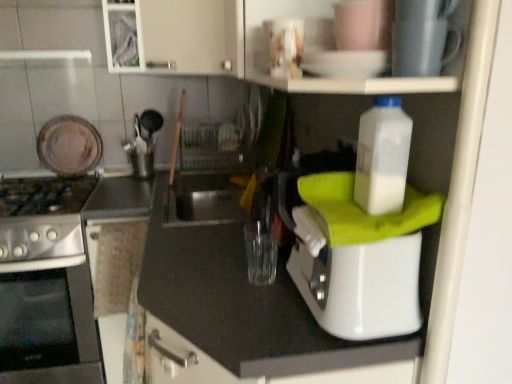
What do you see at coordinates (382, 157) in the screenshot?
I see `white plastic bottle at upper right` at bounding box center [382, 157].

The image size is (512, 384). In order to click on white plastic bottle at upper right in this screenshot , I will do `click(382, 157)`.

Image resolution: width=512 pixels, height=384 pixels. I want to click on matte brown plate at upper left, the second appliance when ordered from right to left, so coord(69,146).

What do you see at coordinates (42, 218) in the screenshot? The width and height of the screenshot is (512, 384). I see `satin silver gas stove at left` at bounding box center [42, 218].

You are a GUI agent. You are given a task and a screenshot of the screen. Output one action in this format:
    pyautogui.click(x=<x>, y=<y>)
    Task: Click on the white matte cabinet at upper center
    
    Given the screenshot: What is the action you would take?
    pyautogui.click(x=175, y=36)

Is metallic silver cup at upper center, positioned as the second appliance in back-to-front order, bigger than matte brown plate at upper left, the second appliance when ordered from right to left?

No, metallic silver cup at upper center, positioned as the second appliance in back-to-front order, is not bigger than matte brown plate at upper left, the second appliance when ordered from right to left.

Does metallic silver cup at upper center, the 1th appliance from the front, turn towards matte brown plate at upper left, positioned as the first appliance in left-to-right order?

No, metallic silver cup at upper center, the 1th appliance from the front, is not aimed at matte brown plate at upper left, positioned as the first appliance in left-to-right order.

Considering the sizes of objects metallic silver cup at upper center, which appears as the 1th appliance when viewed from the right, and matte brown plate at upper left, which is the 1th appliance from back to front, in the image provided, who is shorter, metallic silver cup at upper center, which appears as the 1th appliance when viewed from the right, or matte brown plate at upper left, which is the 1th appliance from back to front,?

With less height is metallic silver cup at upper center, which appears as the 1th appliance when viewed from the right.

Is metallic silver cup at upper center, positioned as the second appliance in back-to-front order, oriented towards white matte cabinet at upper center?

No.

Considering the positions of objects metallic silver cup at upper center, the 1th appliance from the front, and white matte cabinet at upper center in the image provided, who is more to the right, metallic silver cup at upper center, the 1th appliance from the front, or white matte cabinet at upper center?

metallic silver cup at upper center, the 1th appliance from the front.

Considering their positions, is metallic silver cup at upper center, positioned as the second appliance in back-to-front order, located in front of or behind white matte cabinet at upper center?

metallic silver cup at upper center, positioned as the second appliance in back-to-front order, is positioned closer to the viewer than white matte cabinet at upper center.

This screenshot has height=384, width=512. Identify the location of home appliance below the white plastic bottle at upper right (from the image's perspective). (46, 284).

Can you confirm if stainless steel oven at left is bigger than white plastic bottle at upper right?

Correct, stainless steel oven at left is larger in size than white plastic bottle at upper right.

Are stainless steel oven at left and white plastic bottle at upper right located far from each other?

Yes.

How many degrees apart are the facing directions of matte brown plate at upper left, the second appliance when ordered from right to left, and white matte cabinet at upper center?

There is a 47.6-degree angle between the facing directions of matte brown plate at upper left, the second appliance when ordered from right to left, and white matte cabinet at upper center.

Considering the positions of point (91, 151) and point (231, 43), is point (91, 151) closer or farther from the camera than point (231, 43)?

Point (91, 151) is positioned farther from the camera compared to point (231, 43).

Relative to white matte cabinet at upper center, is matte brown plate at upper left, which is the 1th appliance from back to front, in front or behind?

In the image, matte brown plate at upper left, which is the 1th appliance from back to front, appears behind white matte cabinet at upper center.

Does matte brown plate at upper left, the second appliance when ordered from right to left, have a smaller size compared to white matte cabinet at upper center?

Correct, matte brown plate at upper left, the second appliance when ordered from right to left, occupies less space than white matte cabinet at upper center.

Where is `bottle that appears in front of the white matte cabinet at upper center`? Image resolution: width=512 pixels, height=384 pixels. bottle that appears in front of the white matte cabinet at upper center is located at coordinates click(x=382, y=157).

Is white matte cabinet at upper center in contact with white plastic bottle at upper right?

There is a gap between white matte cabinet at upper center and white plastic bottle at upper right.

Which is nearer, (x=238, y=22) or (x=362, y=166)?

Point (x=238, y=22) appears to be farther away from the viewer than point (x=362, y=166).

Considering the positions of objects matte brown plate at upper left, acting as the second appliance starting from the front, and stainless steel oven at left in the image provided, who is more to the right, matte brown plate at upper left, acting as the second appliance starting from the front, or stainless steel oven at left?

matte brown plate at upper left, acting as the second appliance starting from the front.

Is matte brown plate at upper left, which is the 1th appliance from back to front, not inside stainless steel oven at left?

Yes, matte brown plate at upper left, which is the 1th appliance from back to front, is outside of stainless steel oven at left.

What's the angular difference between matte brown plate at upper left, the second appliance when ordered from right to left, and stainless steel oven at left's facing directions?

1.98 degrees.

Would you consider matte brown plate at upper left, which is the 1th appliance from back to front, to be distant from stainless steel oven at left?

No.

Can you confirm if white matte cabinet at upper center is positioned to the right of matte brown plate at upper left, positioned as the first appliance in left-to-right order?

Yes.

From the image's perspective, which is above, white matte cabinet at upper center or matte brown plate at upper left, positioned as the first appliance in left-to-right order?

white matte cabinet at upper center appears higher in the image.

Does white matte cabinet at upper center have a larger size compared to matte brown plate at upper left, which is the 1th appliance from back to front?

Correct, white matte cabinet at upper center is larger in size than matte brown plate at upper left, which is the 1th appliance from back to front.

Find the location of a particular element. This screenshot has width=512, height=384. appliance directly beneath the metallic silver cup at upper center, positioned as the second appliance in back-to-front order (from a real-world perspective) is located at coordinates (69, 146).

This screenshot has width=512, height=384. I want to click on cabinetry above the metallic silver cup at upper center, which appears as the 1th appliance when viewed from the right (from the image's perspective), so click(x=175, y=36).

Looking at the image, which one is located closer to stainless steel oven at left, matte brown plate at upper left, which is the 1th appliance from back to front, or white plastic bottle at upper right?

matte brown plate at upper left, which is the 1th appliance from back to front, lies closer to stainless steel oven at left than the other object.

Estimate the real-world distances between objects in this image. Which object is closer to satin silver gas stove at left, stainless steel oven at left or matte brown plate at upper left, the second appliance when ordered from right to left?

stainless steel oven at left is closer to satin silver gas stove at left.

Considering their positions, is white matte cabinet at upper center positioned further to metallic silver cup at upper center, the 2th appliance from the left, than stainless steel oven at left?

The object further to metallic silver cup at upper center, the 2th appliance from the left, is stainless steel oven at left.

Estimate the real-world distances between objects in this image. Which object is closer to matte brown plate at upper left, which is the 1th appliance from back to front, metallic silver cup at upper center, the 2th appliance from the left, or white matte cabinet at upper center?

white matte cabinet at upper center.

Looking at the image, which one is located further to stainless steel oven at left, matte brown plate at upper left, which is the 1th appliance from back to front, or metallic silver cup at upper center, the 1th appliance from the front?

The object further to stainless steel oven at left is metallic silver cup at upper center, the 1th appliance from the front.

Which object lies nearer to the anchor point stainless steel oven at left, white plastic bottle at upper right or white matte cabinet at upper center?

white matte cabinet at upper center is positioned closer to the anchor stainless steel oven at left.

Based on their spatial positions, is white matte cabinet at upper center or metallic silver cup at upper center, which appears as the 1th appliance when viewed from the right, further from white plastic bottle at upper right?

white matte cabinet at upper center.

Consider the image. Which object lies further to the anchor point white plastic bottle at upper right, matte brown plate at upper left, which is the 1th appliance from back to front, or satin silver gas stove at left?

The object further to white plastic bottle at upper right is matte brown plate at upper left, which is the 1th appliance from back to front.

You are a GUI agent. You are given a task and a screenshot of the screen. Output one action in this format:
    pyautogui.click(x=<x>, y=<y>)
    Task: Click on the cabinetry between metallic silver cup at upper center, the 2th appliance from the left, and matte brown plate at upper left, the second appliance when ordered from right to left, from front to back
    The height and width of the screenshot is (384, 512).
    Given the screenshot: What is the action you would take?
    pyautogui.click(x=175, y=36)

The height and width of the screenshot is (384, 512). What are the coordinates of `cabinetry between white plastic bottle at upper right and matte brown plate at upper left, acting as the second appliance starting from the front, from front to back` in the screenshot? It's located at (175, 36).

This screenshot has height=384, width=512. I want to click on appliance situated between stainless steel oven at left and metallic silver cup at upper center, positioned as the second appliance in back-to-front order, from left to right, so click(69, 146).

Locate an element on the screen. bottle located between metallic silver cup at upper center, the 1th appliance from the front, and white matte cabinet at upper center in the depth direction is located at coordinates (382, 157).